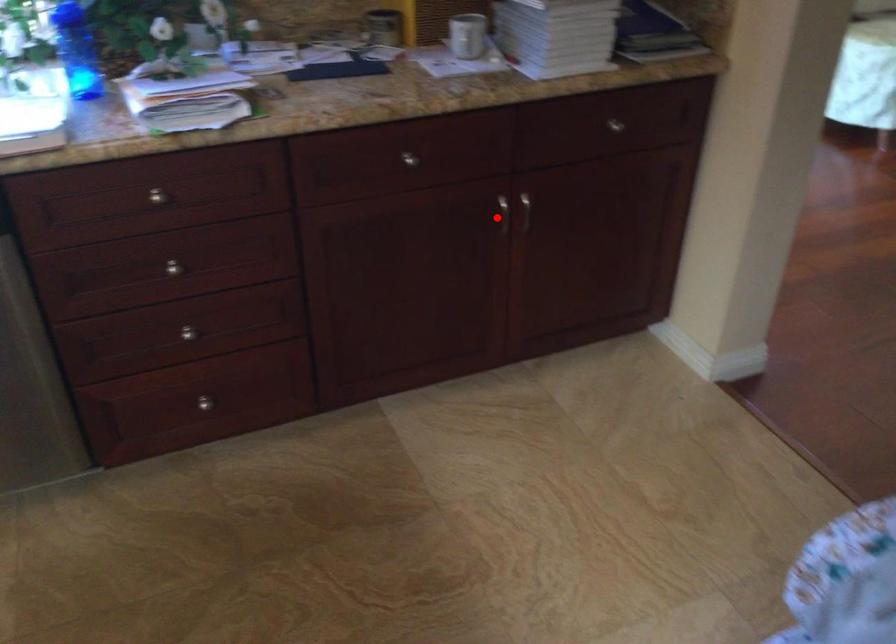
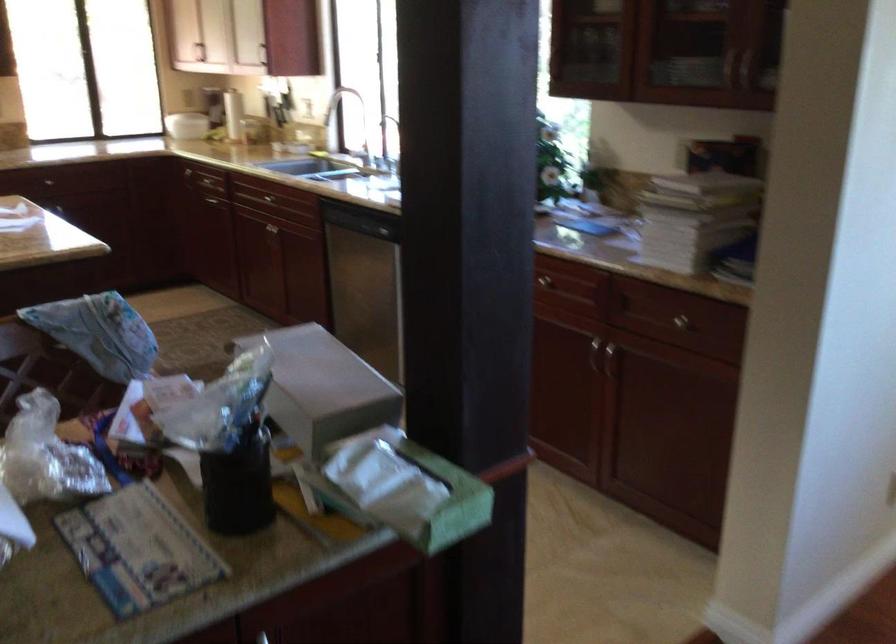
Where in the second image is the point corresponding to the highlighted location from the first image?

(593, 355)